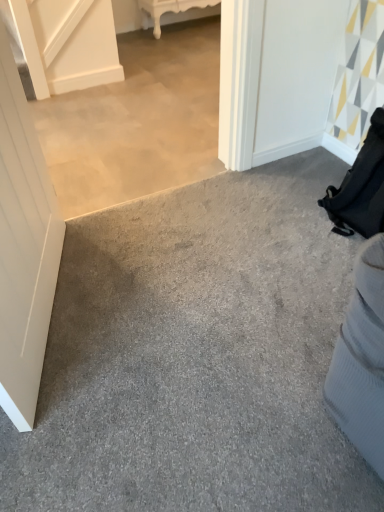
Question: Is white matte door at left completely or partially outside of gray carpet at lower right?

Choices:
 (A) no
 (B) yes

Answer: (B)

Question: Can you confirm if white matte door at left is wider than gray carpet at lower right?

Choices:
 (A) yes
 (B) no

Answer: (B)

Question: From a real-world perspective, is white matte door at left physically below gray carpet at lower right?

Choices:
 (A) no
 (B) yes

Answer: (A)

Question: Can you confirm if white matte door at left is taller than gray carpet at lower right?

Choices:
 (A) no
 (B) yes

Answer: (B)

Question: From the image's perspective, is white matte door at left beneath gray carpet at lower right?

Choices:
 (A) yes
 (B) no

Answer: (B)

Question: Could gray carpet at lower right be considered to be inside white matte door at left?

Choices:
 (A) no
 (B) yes

Answer: (A)

Question: Would you say white glossy table at upper center is a long distance from gray carpet at lower right?

Choices:
 (A) no
 (B) yes

Answer: (B)

Question: Does white glossy table at upper center have a greater width compared to gray carpet at lower right?

Choices:
 (A) yes
 (B) no

Answer: (B)

Question: Does white glossy table at upper center have a lesser height compared to gray carpet at lower right?

Choices:
 (A) no
 (B) yes

Answer: (A)

Question: Is white glossy table at upper center with gray carpet at lower right?

Choices:
 (A) no
 (B) yes

Answer: (A)

Question: From the image's perspective, is white glossy table at upper center above gray carpet at lower right?

Choices:
 (A) yes
 (B) no

Answer: (A)

Question: Is white glossy table at upper center taller than gray carpet at lower right?

Choices:
 (A) yes
 (B) no

Answer: (A)

Question: Is gray carpet at lower right smaller than white glossy table at upper center?

Choices:
 (A) yes
 (B) no

Answer: (B)